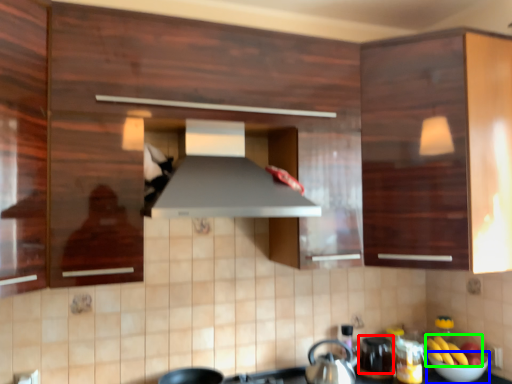
Question: Which object is the closest to the appliance (highlighted by a red box)? Choose among these: bowl (highlighted by a blue box) or banana (highlighted by a green box).

Choices:
 (A) bowl
 (B) banana

Answer: (B)